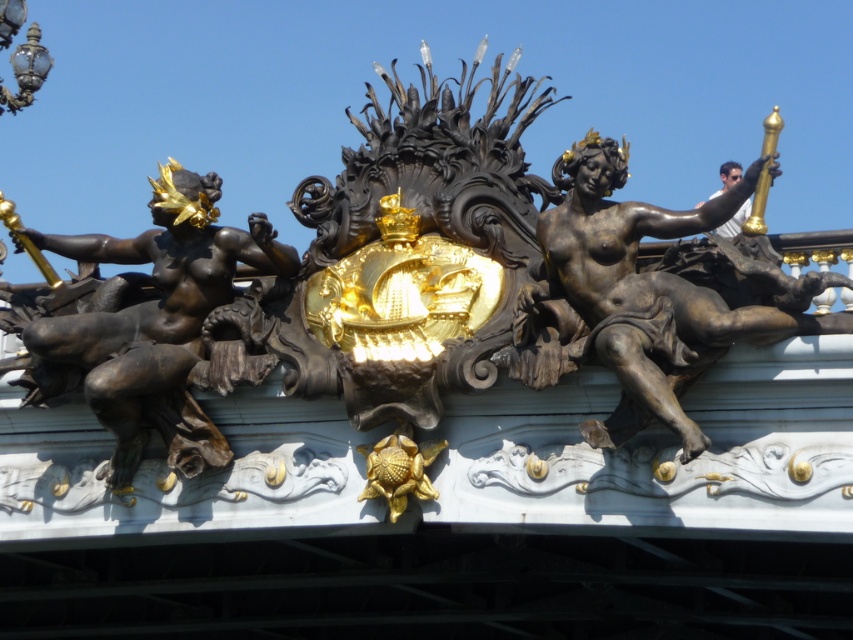
You are an art conservator assessing the structural stability of the bronze statue at left and bronze statue at right. Given their heights, which statue might require more reinforcement to prevent toppling over?

The bronze statue at left is much taller than the bronze statue at right, so it might require more reinforcement to prevent toppling over due to its greater height increasing the risk of instability.

You are an art conservator assessing the two bronze statues in the image. Based on their sizes, which one requires more material for restoration? Please refer to the bronze statue at left and bronze statue at right in your answer.

The bronze statue at left requires more material for restoration since it is larger in size than the bronze statue at right.

You are an architect analyzing the spatial layout of this historical structure. You need to determine the exact position of the bronze statue at left relative to the central emblem. Can you provide its coordinates?

The bronze statue at left is located at coordinates (146, 323) relative to the central emblem.